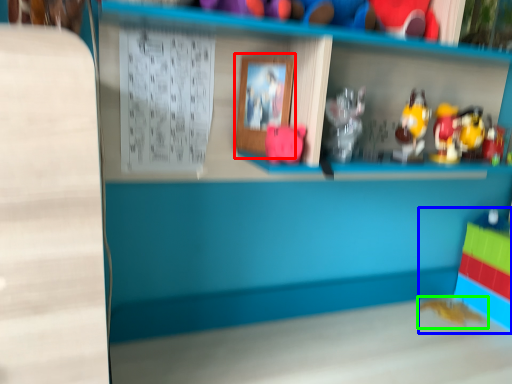
Question: Considering the real-world distances, which object is farthest from picture frame (highlighted by a red box)? toy (highlighted by a blue box) or toy (highlighted by a green box)?

Choices:
 (A) toy
 (B) toy

Answer: (A)